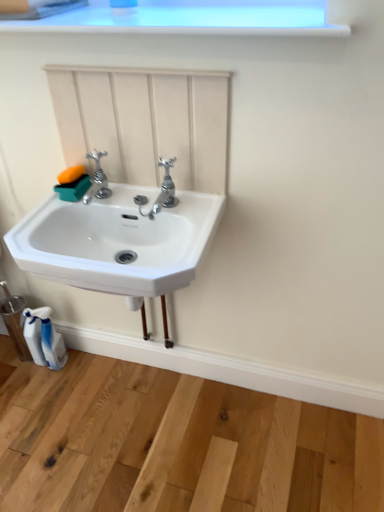
This screenshot has height=512, width=384. Find the location of `free location in front of white plastic spray bottle at lower left`. free location in front of white plastic spray bottle at lower left is located at coordinates (48, 399).